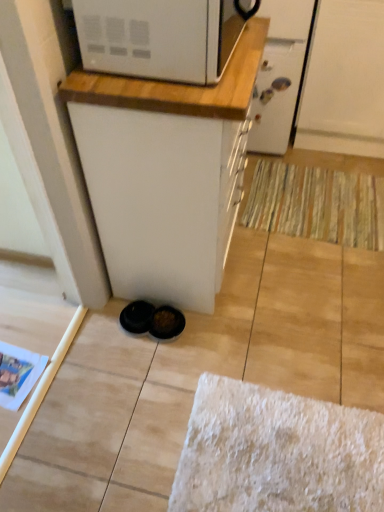
Question: From a real-world perspective, is white matte screen door at upper right, placed as the 2th screen door when sorted from left to right, physically below white wood countertop at upper center?

Choices:
 (A) no
 (B) yes

Answer: (B)

Question: Is white matte screen door at upper right, placed as the 2th screen door when sorted from left to right, located outside white wood countertop at upper center?

Choices:
 (A) yes
 (B) no

Answer: (A)

Question: Can you confirm if white matte screen door at upper right, placed as the 2th screen door when sorted from left to right, is shorter than white wood countertop at upper center?

Choices:
 (A) yes
 (B) no

Answer: (B)

Question: From the image's perspective, would you say white matte screen door at upper right, placed as the 2th screen door when sorted from left to right, is shown under white wood countertop at upper center?

Choices:
 (A) no
 (B) yes

Answer: (A)

Question: Is white matte screen door at upper right, which is the 1th screen door from right to left, behind white wood countertop at upper center?

Choices:
 (A) no
 (B) yes

Answer: (B)

Question: Does white matte screen door at upper right, placed as the 2th screen door when sorted from left to right, have a greater width compared to white wood countertop at upper center?

Choices:
 (A) no
 (B) yes

Answer: (B)

Question: Is striped fabric doormat at lower right turned away from white wood countertop at upper center?

Choices:
 (A) no
 (B) yes

Answer: (A)

Question: Could you tell me if striped fabric doormat at lower right is facing white wood countertop at upper center?

Choices:
 (A) yes
 (B) no

Answer: (B)

Question: Is striped fabric doormat at lower right closer to camera compared to white wood countertop at upper center?

Choices:
 (A) no
 (B) yes

Answer: (A)

Question: Is the surface of striped fabric doormat at lower right in direct contact with white wood countertop at upper center?

Choices:
 (A) yes
 (B) no

Answer: (B)

Question: Is striped fabric doormat at lower right further to camera compared to white wood countertop at upper center?

Choices:
 (A) yes
 (B) no

Answer: (A)

Question: Considering the relative positions of striped fabric doormat at lower right and white wood countertop at upper center in the image provided, is striped fabric doormat at lower right to the left of white wood countertop at upper center from the viewer's perspective?

Choices:
 (A) no
 (B) yes

Answer: (A)

Question: Are white glossy screen door at upper center, which ranks as the second screen door in right-to-left order, and white wood countertop at upper center far apart?

Choices:
 (A) yes
 (B) no

Answer: (B)